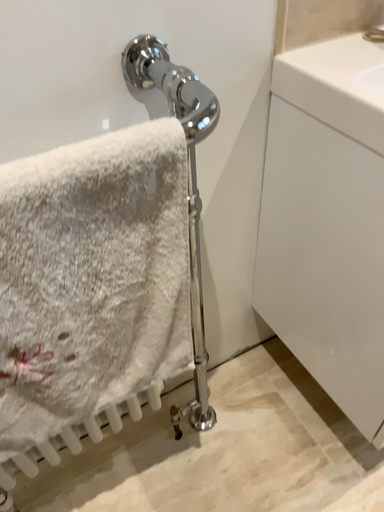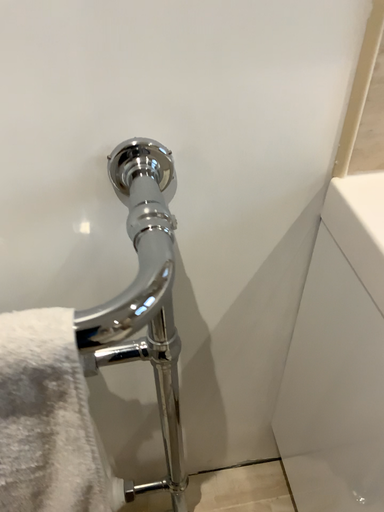
Question: How did the camera likely rotate when shooting the video?

Choices:
 (A) rotated left
 (B) rotated right

Answer: (A)